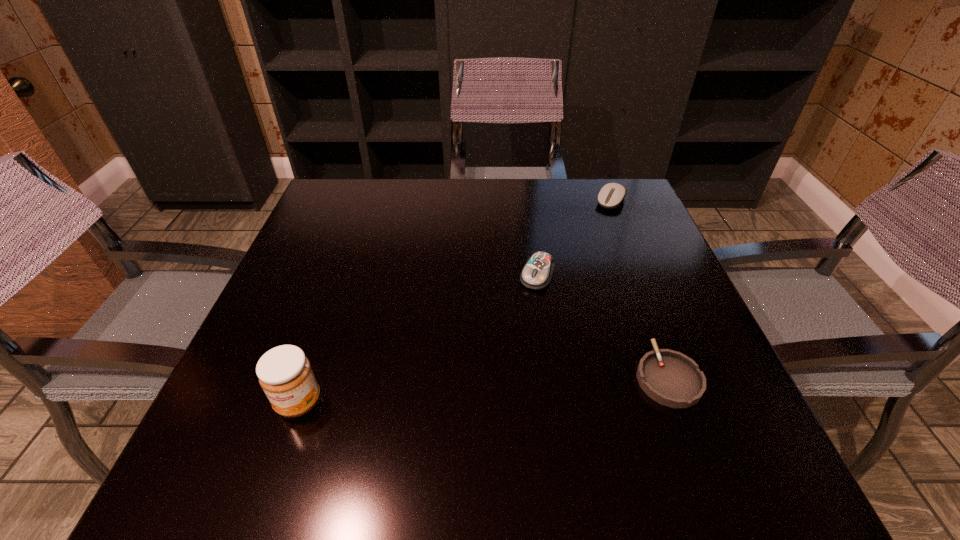
This screenshot has width=960, height=540. I want to click on vacant region between the tallest object and the third nearest object, so click(419, 339).

Identify the location of empty space between the ashtray and the nearer computer mouse. (603, 326).

What are the coordinates of `vacant point located between the second object from left to right and the ashtray` in the screenshot? It's located at (603, 326).

Identify the location of free space between the second farthest object and the leftmost object. (419, 339).

You are a GUI agent. You are given a task and a screenshot of the screen. Output one action in this format:
    pyautogui.click(x=<x>, y=<y>)
    Task: Click on the free space between the jam and the left computer mouse
    The image size is (960, 540).
    Given the screenshot: What is the action you would take?
    pyautogui.click(x=419, y=339)

Locate an element on the screen. Image resolution: width=960 pixels, height=540 pixels. vacant space that is in between the leftmost object and the second object from left to right is located at coordinates (419, 339).

At what (x,y) coordinates should I click in order to perform the action: click on vacant area that lies between the farthest object and the leftmost object. Please return your answer as a coordinate pair (x, y). The image size is (960, 540). Looking at the image, I should click on (455, 301).

In order to click on unoccupied position between the shortest object and the nearer computer mouse in this screenshot , I will do `click(603, 326)`.

Find the location of a particular element. The height and width of the screenshot is (540, 960). empty space that is in between the leftmost object and the right computer mouse is located at coordinates (455, 301).

Identify which object is located as the second nearest to the farther computer mouse. Please provide its 2D coordinates. Your answer should be formatted as a tuple, i.e. [(x, y)], where the tuple contains the x and y coordinates of a point satisfying the conditions above.

[(672, 379)]